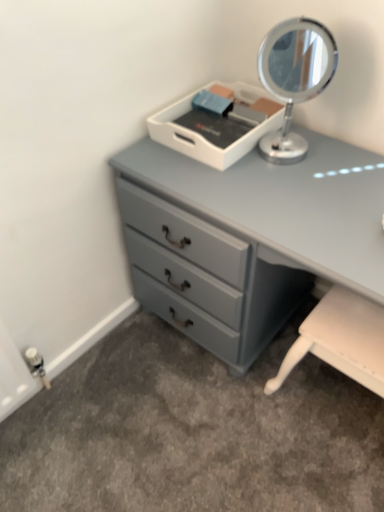
Question: In terms of size, does matte gray dresser at center appear bigger or smaller than silver metallic mirror at upper right?

Choices:
 (A) small
 (B) big

Answer: (B)

Question: Do you think matte gray dresser at center is within silver metallic mirror at upper right, or outside of it?

Choices:
 (A) inside
 (B) outside

Answer: (B)

Question: Is point pyautogui.click(x=264, y=177) positioned closer to the camera than point pyautogui.click(x=301, y=83)?

Choices:
 (A) farther
 (B) closer

Answer: (A)

Question: Is silver metallic mirror at upper right taller or shorter than matte gray dresser at center?

Choices:
 (A) tall
 (B) short

Answer: (B)

Question: From the image's perspective, is silver metallic mirror at upper right above or below matte gray dresser at center?

Choices:
 (A) below
 (B) above

Answer: (B)

Question: Is silver metallic mirror at upper right inside the boundaries of matte gray dresser at center, or outside?

Choices:
 (A) outside
 (B) inside

Answer: (A)

Question: Relative to matte gray dresser at center, is silver metallic mirror at upper right in front or behind?

Choices:
 (A) front
 (B) behind

Answer: (B)